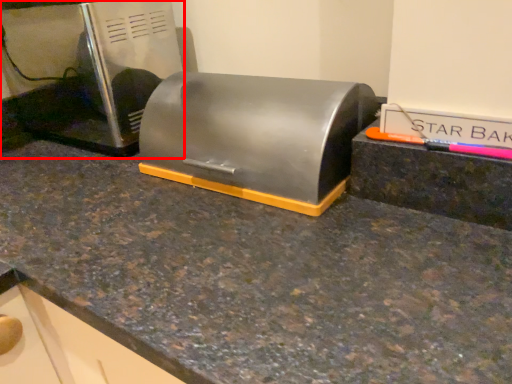
Question: From the image's perspective, considering the relative positions of home appliance (annotated by the red box) and appliance in the image provided, where is home appliance (annotated by the red box) located with respect to the staircase?

Choices:
 (A) below
 (B) above

Answer: (B)